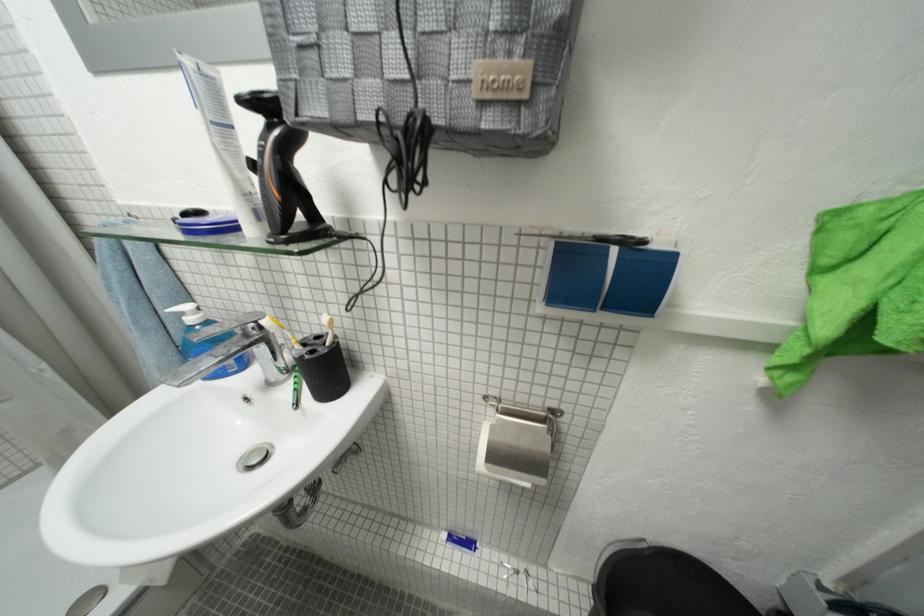
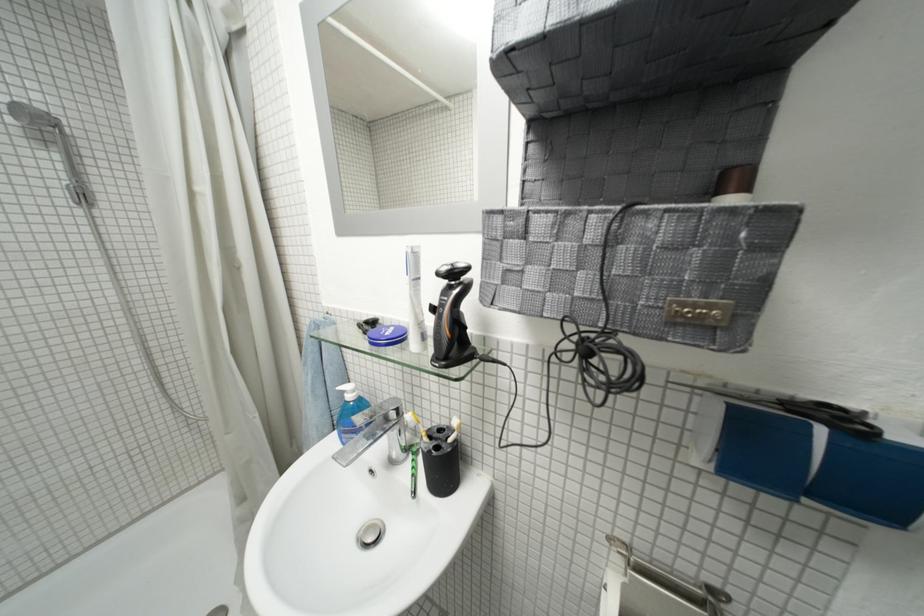
Which direction would the cameraman need to move to produce the second image?

The movement direction of the cameraman is left, backward.